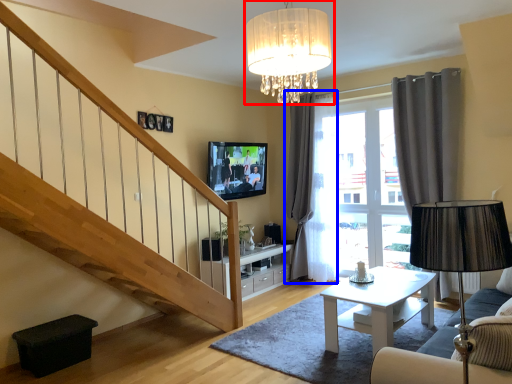
Question: Which object is closer to the camera taking this photo, lamp (highlighted by a red box) or curtain (highlighted by a blue box)?

Choices:
 (A) lamp
 (B) curtain

Answer: (A)